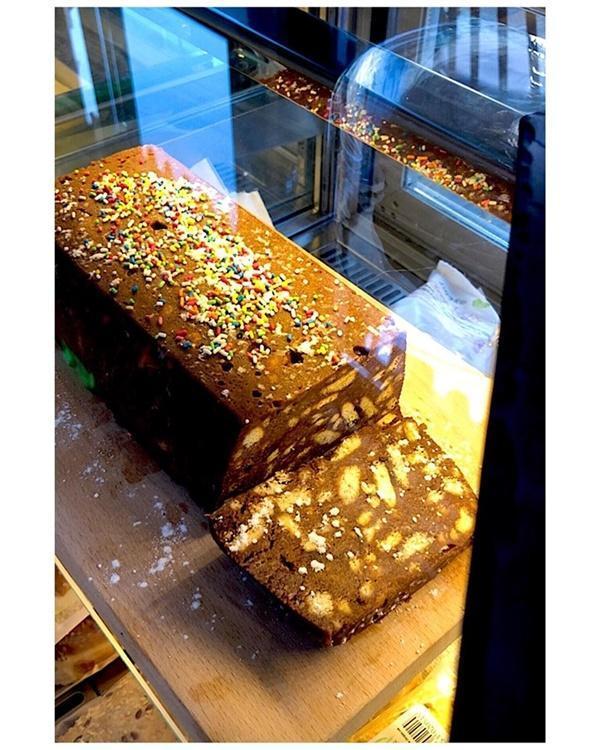
At what (x,y) coordinates should I click in order to perform the action: click on display case. Please return your answer as a coordinate pair (x, y). The height and width of the screenshot is (750, 600). Looking at the image, I should click on 501,121.